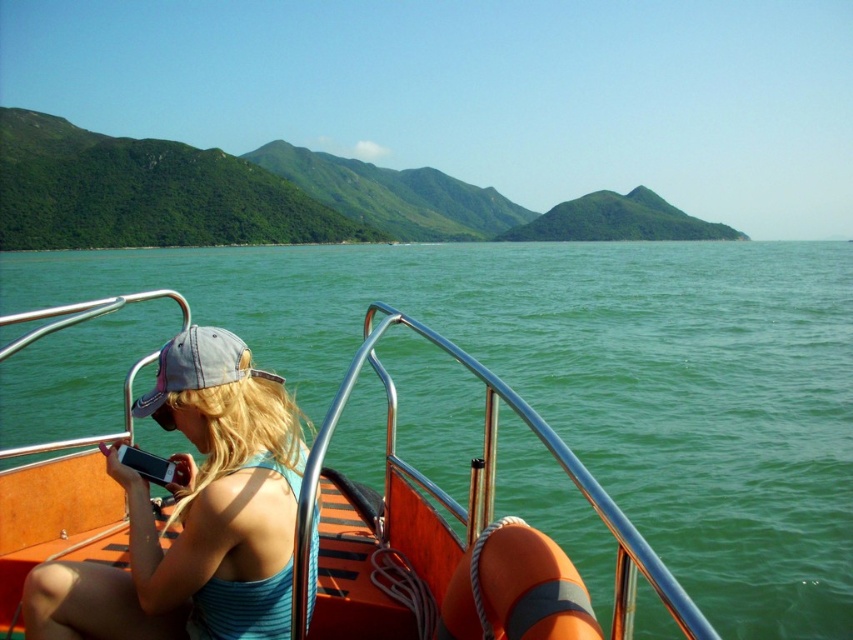
Question: Which point is closer to the camera?

Choices:
 (A) orange wood boat at center
 (B) blue striped tank top at center

Answer: (B)

Question: Which point appears closest to the camera in this image?

Choices:
 (A) (194, 563)
 (B) (381, 380)

Answer: (A)

Question: Can you confirm if orange wood boat at center is positioned to the right of blue striped tank top at center?

Choices:
 (A) no
 (B) yes

Answer: (A)

Question: Does orange wood boat at center have a lesser width compared to blue striped tank top at center?

Choices:
 (A) yes
 (B) no

Answer: (A)

Question: Which of the following is the farthest from the observer?

Choices:
 (A) orange wood boat at center
 (B) blue striped tank top at center

Answer: (A)

Question: Can you confirm if orange wood boat at center is smaller than blue striped tank top at center?

Choices:
 (A) no
 (B) yes

Answer: (B)